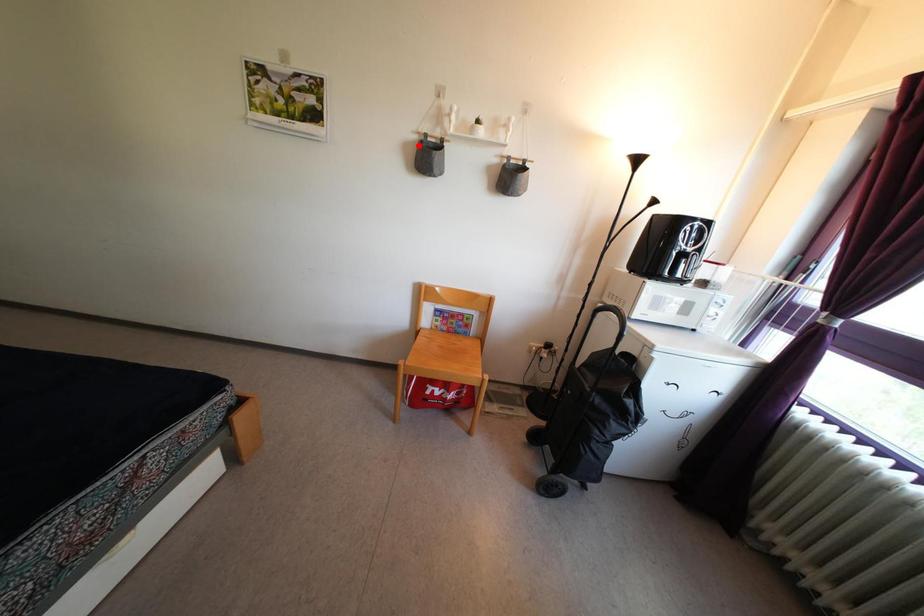
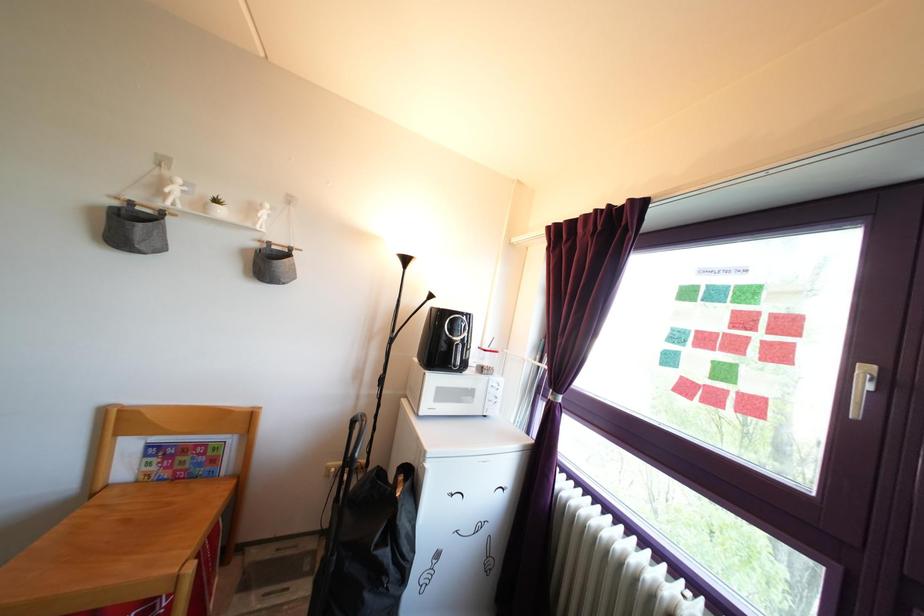
Locate, in the second image, the point that corresponds to the highlighted location in the first image.

(118, 211)